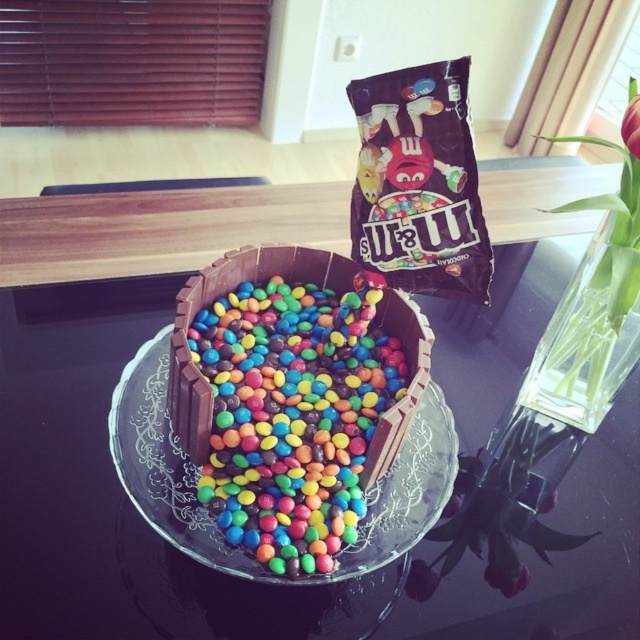
You are setting up a display and need to place both the transparent glass table at center and the transparent glass plate at center on a shelf. If the shelf has limited space, which one should you place first to ensure both fit?

You should place the transparent glass table at center first because it is larger in size than the transparent glass plate at center, so placing the larger item first ensures there is enough space left for the smaller one.

You are holding a small toy car that is 12 inches long. You want to place it on the transparent glass table at center. Based on the distance between you and the table, can the toy car fit entirely on the table without hanging off the edge?

The transparent glass table at center and viewer are 18.68 inches apart. Since the toy car is 12 inches long, which is shorter than the distance between you and the table, the toy car can fit entirely on the transparent glass table at center without hanging off the edge.

You have a small toy car that is 10 cm long. You want to place it on the transparent glass table at center so that it doesn t fall off. Can you fit the toy car entirely on the transparent glass plate at center?

The transparent glass plate at center is smaller than the transparent glass table at center. However, the exact dimensions aren t provided, so we can t determine if the toy car will fit. Check the plate s size before placing the car.